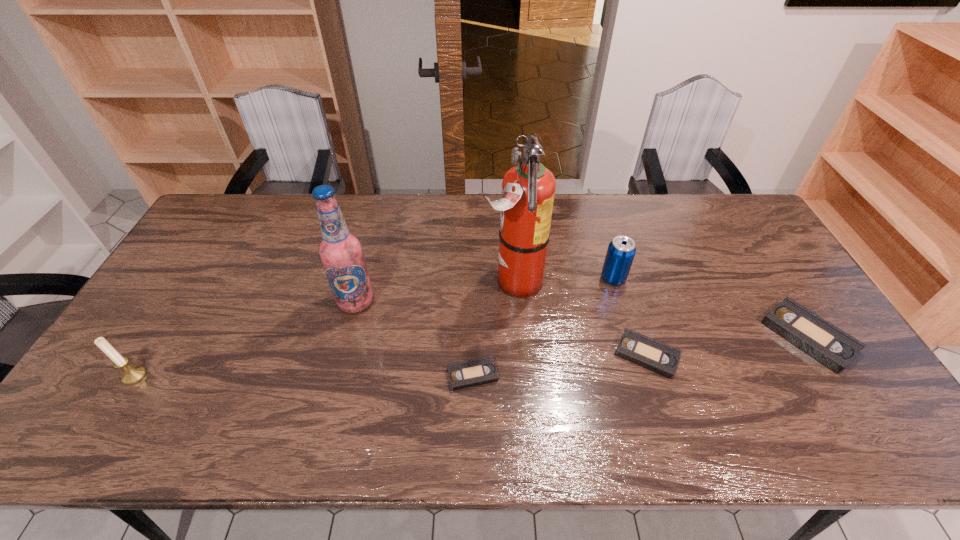
Find the location of a particular element. videotape identified as the second closest to the second shortest object is located at coordinates (465, 374).

At what (x,y) coordinates should I click in order to perform the action: click on vacant area that satisfies the following two spatial constraints: 1. on the back side of the candle holder; 2. on the left side of the second shortest object. Please return your answer as a coordinate pair (x, y). This screenshot has height=540, width=960. Looking at the image, I should click on (148, 355).

Identify the location of free region that satisfies the following two spatial constraints: 1. from the nozzle of the fire extinguisher; 2. on the front side of the sixth shortest object. (515, 302).

Locate an element on the screen. free space that satisfies the following two spatial constraints: 1. on the back side of the leftmost object; 2. on the right side of the alcohol is located at coordinates (180, 302).

This screenshot has height=540, width=960. I want to click on blank area in the image that satisfies the following two spatial constraints: 1. on the front side of the alcohol; 2. on the left side of the shortest videotape, so click(x=337, y=375).

You are a GUI agent. You are given a task and a screenshot of the screen. Output one action in this format:
    pyautogui.click(x=<x>, y=<y>)
    Task: Click on the free space in the image that satisfies the following two spatial constraints: 1. on the front side of the second tallest object; 2. on the right side of the shortest object
    
    Given the screenshot: What is the action you would take?
    pyautogui.click(x=337, y=375)

The image size is (960, 540). I want to click on vacant space that satisfies the following two spatial constraints: 1. on the front side of the second shortest videotape; 2. on the left side of the pop soda, so click(x=636, y=355).

This screenshot has width=960, height=540. Identify the location of vacant point that satisfies the following two spatial constraints: 1. from the nozzle of the tallest object; 2. on the left side of the second videotape from left to right. click(x=518, y=355).